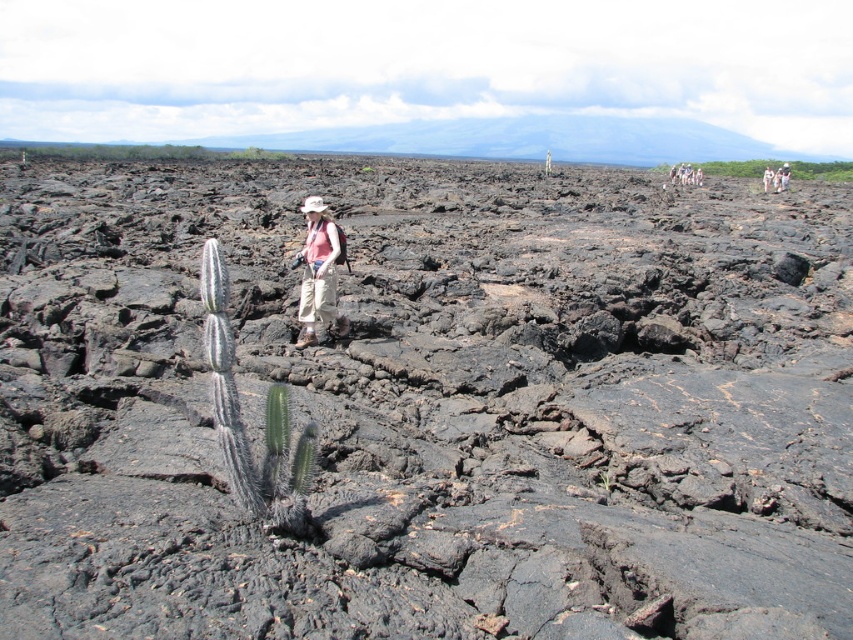
Question: Is green spiky cactus at upper right above green spiky cactus at center?

Choices:
 (A) no
 (B) yes

Answer: (B)

Question: Is matte pink shirt at center positioned at the back of green spiky cactus at upper right?

Choices:
 (A) no
 (B) yes

Answer: (A)

Question: Is green spiny cactus at center smaller than green spiky cactus at upper right?

Choices:
 (A) yes
 (B) no

Answer: (A)

Question: Estimate the real-world distances between objects in this image. Which object is closer to the brown fabric pants at center?

Choices:
 (A) green spiky cactus at center
 (B) matte pink shirt at center

Answer: (A)

Question: Which object appears closest to the camera in this image?

Choices:
 (A) brown fabric pants at center
 (B) green spiny cactus at center
 (C) green spiky cactus at center

Answer: (B)

Question: Which object appears farthest from the camera in this image?

Choices:
 (A) green spiky cactus at upper right
 (B) green spiny cactus at center

Answer: (A)